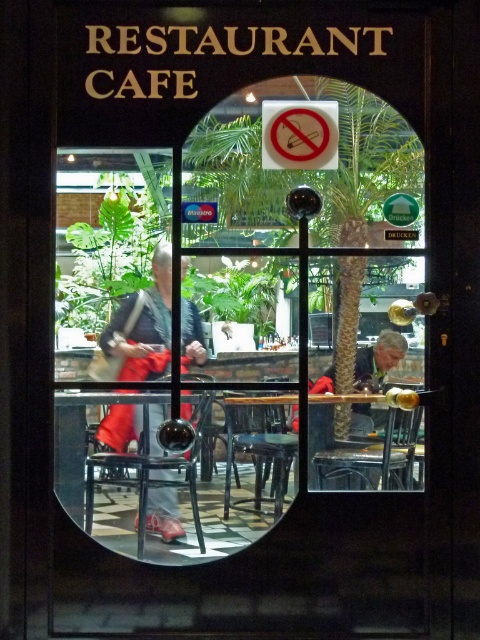
Can you confirm if green leafy palm tree at center is taller than black plastic stool at center?

Yes.

Does green leafy palm tree at center appear over black plastic stool at center?

Yes.

Between point (336, 228) and point (241, 440), which one is positioned in front?

Point (241, 440)

Where is `green leafy palm tree at center`? green leafy palm tree at center is located at coordinates (314, 170).

Which is in front, point (164, 316) or point (326, 148)?

Positioned in front is point (326, 148).

Does matte black jacket at center have a lesser height compared to white paper sign at center?

In fact, matte black jacket at center may be taller than white paper sign at center.

This screenshot has width=480, height=640. I want to click on matte black jacket at center, so click(144, 324).

Is point (153, 328) in front of point (276, 458)?

That is False.

Locate an element on the screen. The image size is (480, 640). matte black jacket at center is located at coordinates (144, 324).

You are a GUI agent. You are given a task and a screenshot of the screen. Output one action in this format:
    pyautogui.click(x=<x>, y=<y>)
    Task: Click on the matte black jacket at center
    
    Given the screenshot: What is the action you would take?
    pyautogui.click(x=144, y=324)